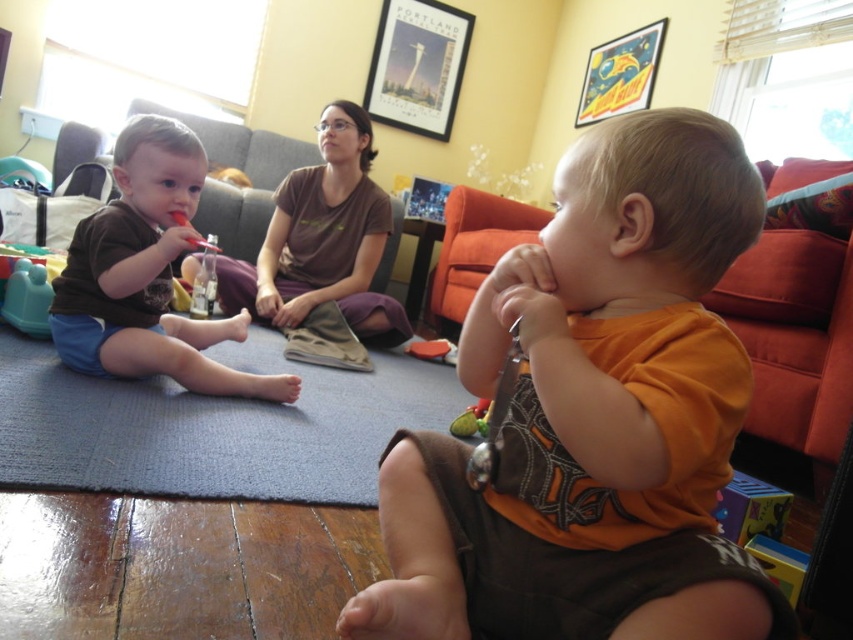
You are a photographer setting up a shoot in this room. You need to position a small light source so it illuminates both the matte brown shorts at left and the metallic poster at upper center without casting shadows on either. Where should you place the light source relative to these objects?

The light source should be placed above both the matte brown shorts at left and the metallic poster at upper center so that it shines down on them, avoiding shadows on either object.

You are a parent trying to hang a new decoration in the room. You see the metallic gold poster at upper right and the matte plastic toy at left. Which object has a greater width?

The metallic gold poster at upper right has a greater width than the matte plastic toy at left.

What is located at the coordinates point (148,275) in the image?

The coordinates point (148,275) in the image correspond to the location of the matte brown shorts at left.